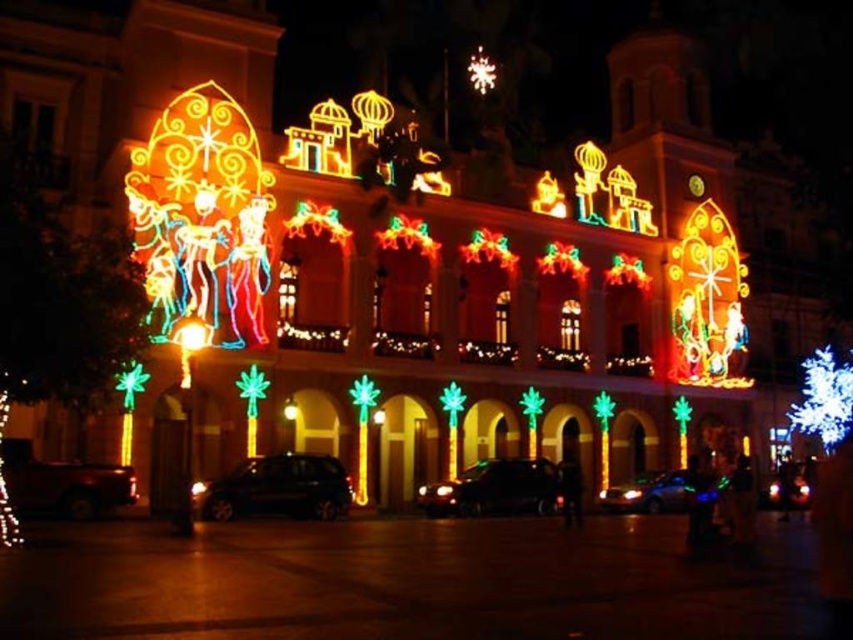
Question: Can you confirm if shiny black car at center is positioned to the left of metallic silver car at lower left?

Choices:
 (A) no
 (B) yes

Answer: (A)

Question: From the image, what is the correct spatial relationship of shiny black car at center in relation to metallic silver car at lower left?

Choices:
 (A) right
 (B) left

Answer: (A)

Question: Which object is farther from the camera taking this photo?

Choices:
 (A) black glossy car at center
 (B) shiny blue car at center
 (C) metallic silver car at lower left

Answer: (B)

Question: Among these objects, which one is nearest to the camera?

Choices:
 (A) black glossy car at center
 (B) metallic silver car at lower left
 (C) shiny black car at center

Answer: (B)

Question: Based on their relative distances, which object is farther from the shiny blue car at center?

Choices:
 (A) black glossy car at center
 (B) shiny black car at center

Answer: (A)

Question: Can you confirm if black glossy car at center is thinner than metallic silver car at lower left?

Choices:
 (A) no
 (B) yes

Answer: (A)